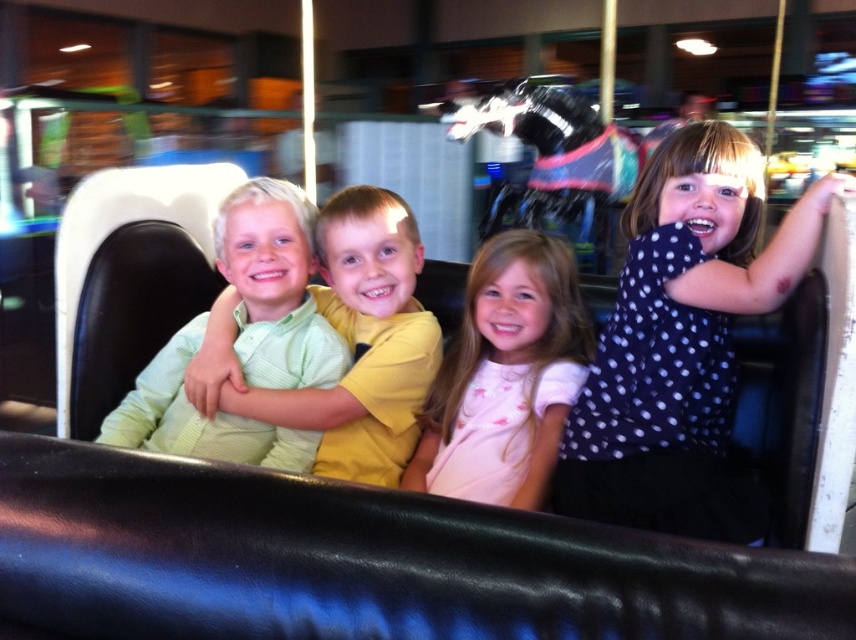
You are a photographer standing in front of the carousel. You want to take a photo of the green textured shirt at center and the pink cotton shirt at center. How far apart are these two shirts?

The green textured shirt at center is 7.74 inches from the pink cotton shirt at center.

You are a photographer trying to capture a group photo of the polka dot blouse at upper right and the green textured shirt at center. Which of the two has a wider appearance in the photo?

The green textured shirt at center has a greater width than the polka dot blouse at upper right, so it will appear wider in the photo.

Looking at this image, you are standing in front of the carousel and notice two points marked on the ride. The first point is at coordinates point (346, 477) and the second point is at point (276, 364). Which point is closer to you?

Point (346, 477) is closer to you because it is further to the camera than point (276, 364).